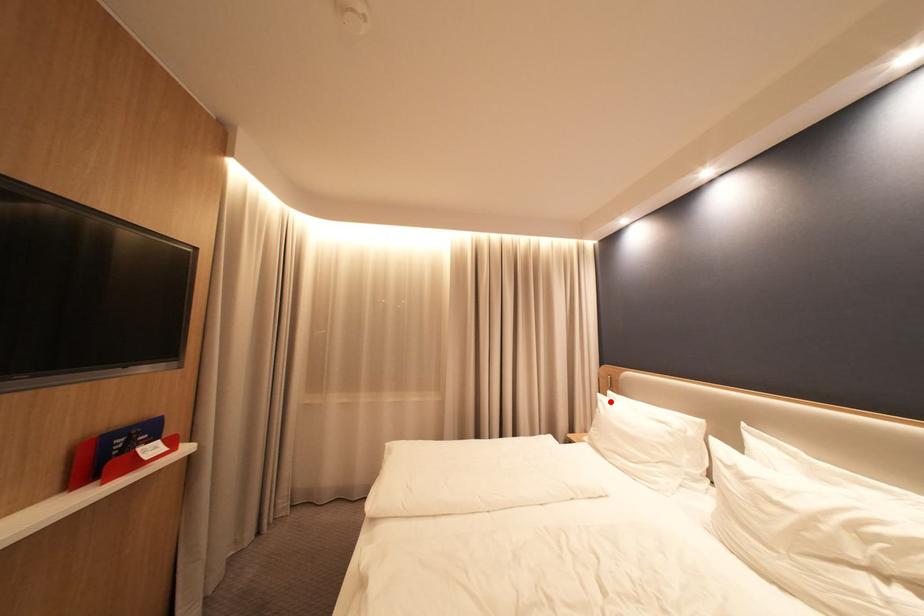
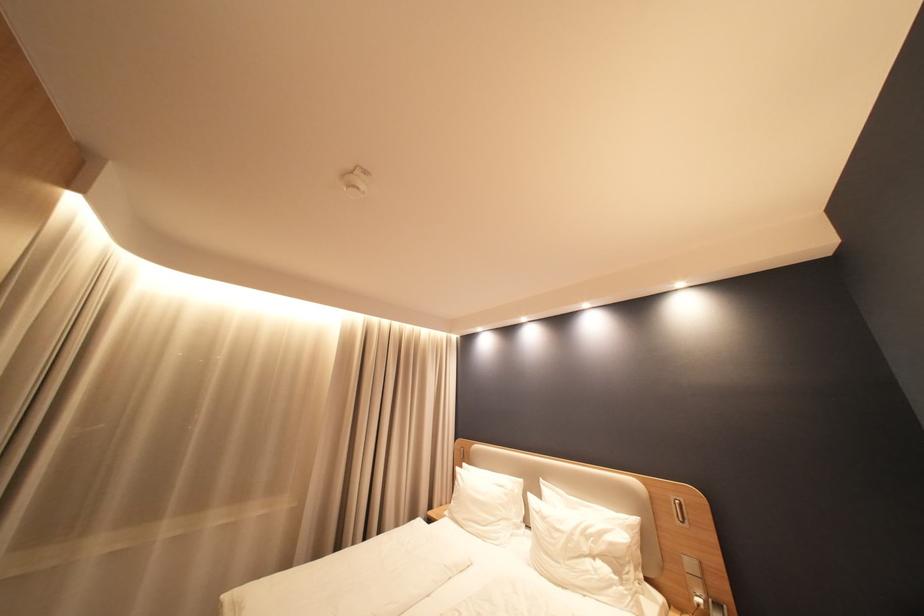
Question: I am providing you with two images of the same scene from different viewpoints. In image1, a red point is highlighted. Considering the same 3D point in image2, which of the following is correct?

Choices:
 (A) It is closer
 (B) It is farther

Answer: (B)